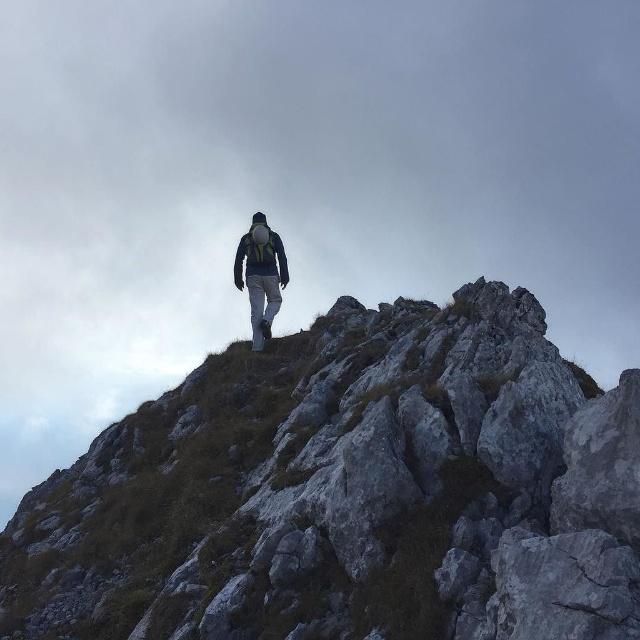
Question: Does matte gray pants at center lie behind dark green fabric jacket at center?

Choices:
 (A) yes
 (B) no

Answer: (B)

Question: Which of the following is the farthest from the observer?

Choices:
 (A) matte gray pants at center
 (B) dark green fabric jacket at center

Answer: (B)

Question: Observing the image, what is the correct spatial positioning of gray rocky mountain at center in reference to matte gray pants at center?

Choices:
 (A) below
 (B) above

Answer: (A)

Question: Is matte gray pants at center wider than dark green fabric jacket at center?

Choices:
 (A) no
 (B) yes

Answer: (A)

Question: Which object is positioned closest to the matte gray pants at center?

Choices:
 (A) gray rocky mountain at center
 (B) dark green fabric jacket at center

Answer: (B)

Question: Which of the following is the farthest from the observer?

Choices:
 (A) gray rocky mountain at center
 (B) matte gray pants at center
 (C) dark green fabric jacket at center

Answer: (C)